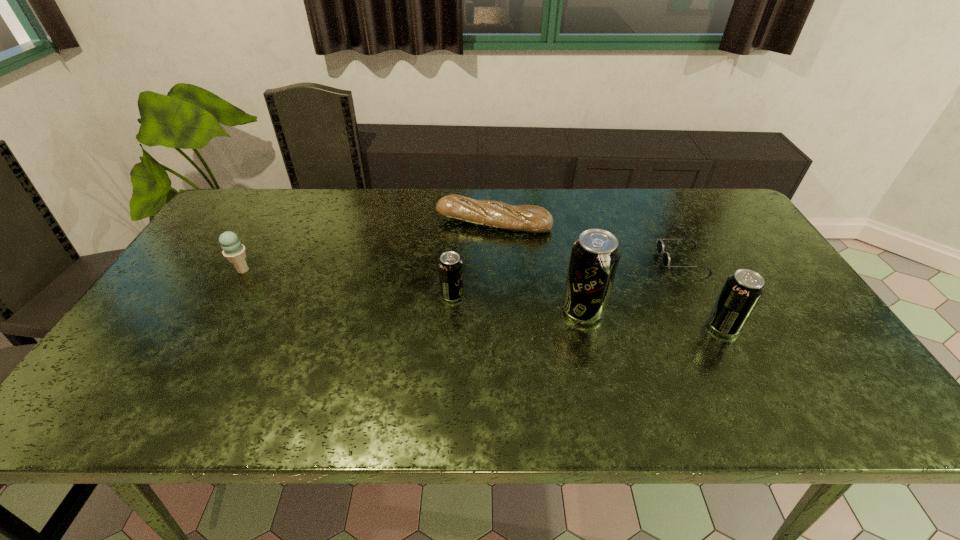
Locate an element on the screen. The height and width of the screenshot is (540, 960). the shortest soda can is located at coordinates (450, 266).

Image resolution: width=960 pixels, height=540 pixels. I want to click on the tallest soda can, so click(595, 255).

This screenshot has height=540, width=960. I want to click on the tallest object, so click(595, 255).

Locate an element on the screen. the second tallest soda can is located at coordinates (742, 290).

Locate an element on the screen. the fifth shortest object is located at coordinates (742, 290).

Image resolution: width=960 pixels, height=540 pixels. I want to click on baguet, so click(530, 218).

Where is `the second shortest object`? The width and height of the screenshot is (960, 540). the second shortest object is located at coordinates pos(530,218).

At what (x,y) coordinates should I click in order to perform the action: click on the shortest object. Please return your answer as a coordinate pair (x, y). The image size is (960, 540). Looking at the image, I should click on (660, 245).

Image resolution: width=960 pixels, height=540 pixels. In order to click on the leftmost object in this screenshot , I will do `click(233, 250)`.

At what (x,y) coordinates should I click in order to perform the action: click on free space located 0.080m on the back of the shortest soda can. Please return your answer as a coordinate pair (x, y). Looking at the image, I should click on (454, 267).